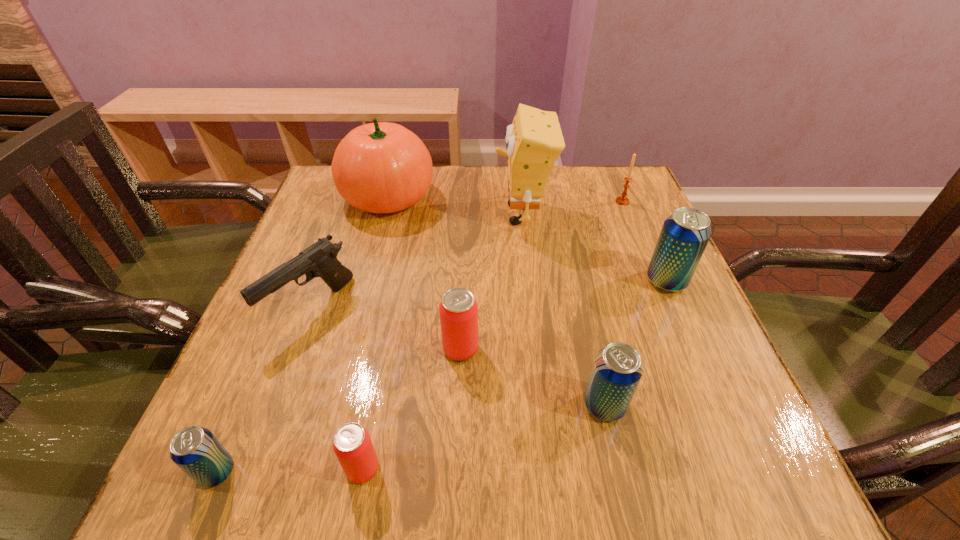
Find the location of a particular element. This screenshot has height=540, width=960. free space located 0.120m at the muzzle of the black gun is located at coordinates (276, 401).

This screenshot has height=540, width=960. Identify the location of free space located 0.050m on the right of the third beer can from left to right. (506, 349).

This screenshot has height=540, width=960. Identify the location of blank space located on the left of the second beer can from right to left. (535, 405).

At what (x,y) coordinates should I click in order to perform the action: click on free space located on the back of the smallest blue beer can. Please return your answer as a coordinate pair (x, y). The width and height of the screenshot is (960, 540). Looking at the image, I should click on click(x=252, y=391).

Identify the location of vacant space situated on the right of the left red beer can. This screenshot has width=960, height=540. (501, 469).

Where is `sponge that is at the far edge`? The image size is (960, 540). sponge that is at the far edge is located at coordinates (534, 141).

This screenshot has width=960, height=540. I want to click on pumpkin located at the far edge, so click(x=381, y=167).

Where is `candle_holder that is at the far edge`? This screenshot has width=960, height=540. candle_holder that is at the far edge is located at coordinates (622, 200).

This screenshot has height=540, width=960. Identify the location of pumpkin at the left edge. (381, 167).

Locate an element on the screen. gun present at the left edge is located at coordinates (320, 259).